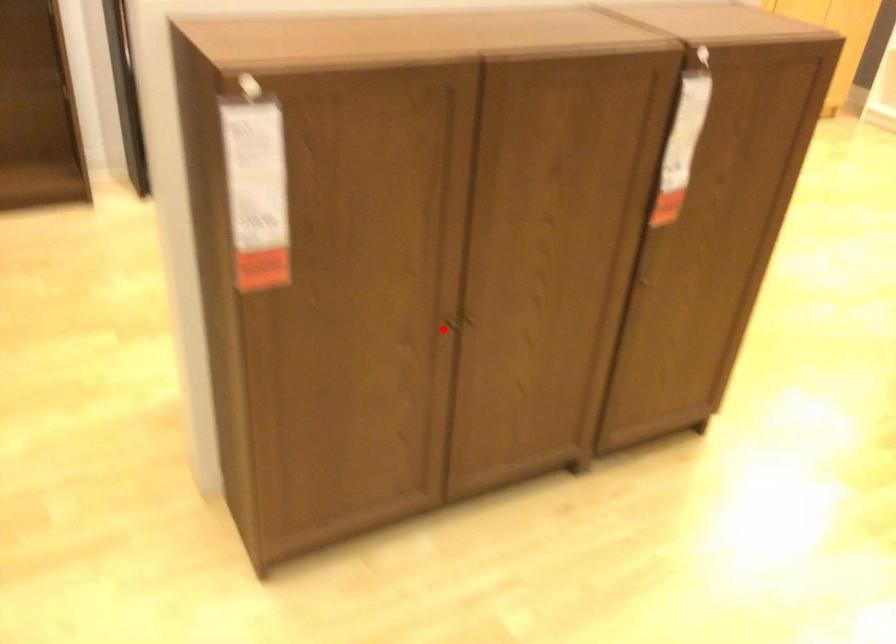
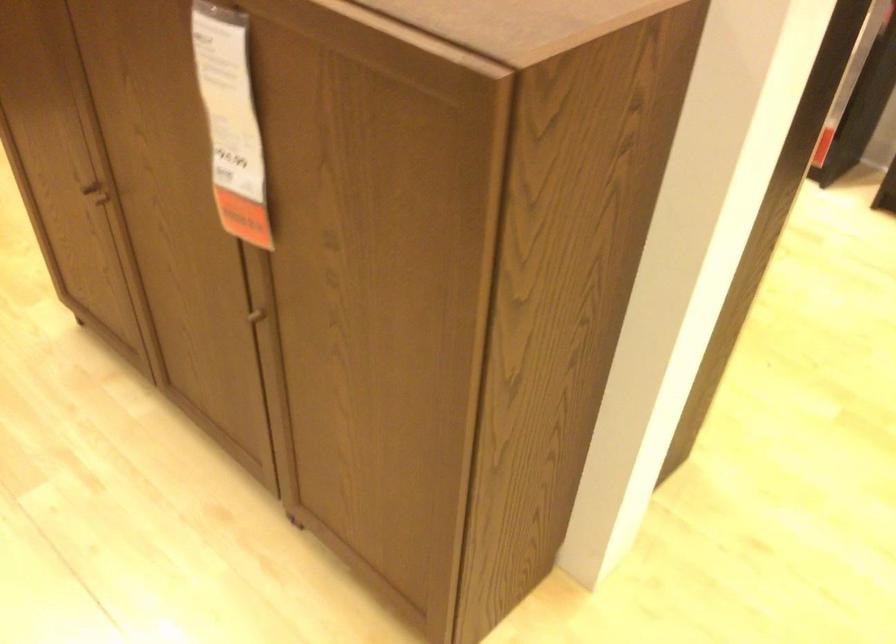
Question: I am providing you with two images of the same scene from different viewpoints. Given a red point in image1, look at the same physical point in image2. Is it:

Choices:
 (A) Closer to the viewpoint
 (B) Farther from the viewpoint

Answer: (A)